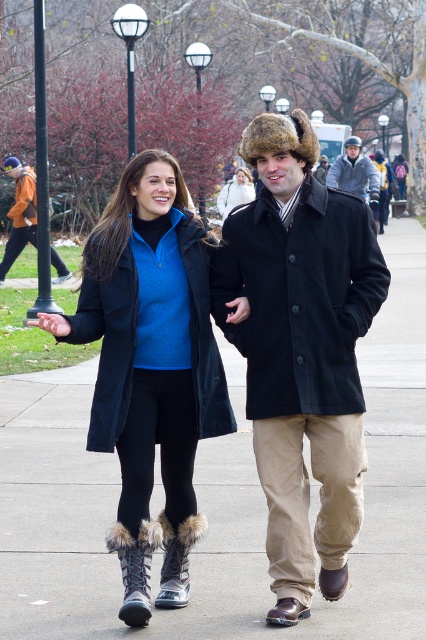
Question: Does fur-lined boots at center have a greater width compared to matte black coat at center?

Choices:
 (A) yes
 (B) no

Answer: (A)

Question: Which object is the closest to the matte black coat at center?

Choices:
 (A) fur-lined boots at center
 (B) smooth concrete sidewalk at center

Answer: (A)

Question: Which point is closer to the camera?

Choices:
 (A) orange jacket at left
 (B) fur-lined boots at center
 (C) black wool coat at center

Answer: (B)

Question: Considering the relative positions of orange jacket at left and gray fleece jacket at center in the image provided, where is orange jacket at left located with respect to gray fleece jacket at center?

Choices:
 (A) below
 (B) above

Answer: (A)

Question: Which is nearer to the orange jacket at left?

Choices:
 (A) black wool coat at center
 (B) gray fleece jacket at center
 (C) matte black coat at center

Answer: (B)

Question: Is dark brown fur hat at center to the right of black wool coat at center from the viewer's perspective?

Choices:
 (A) yes
 (B) no

Answer: (A)